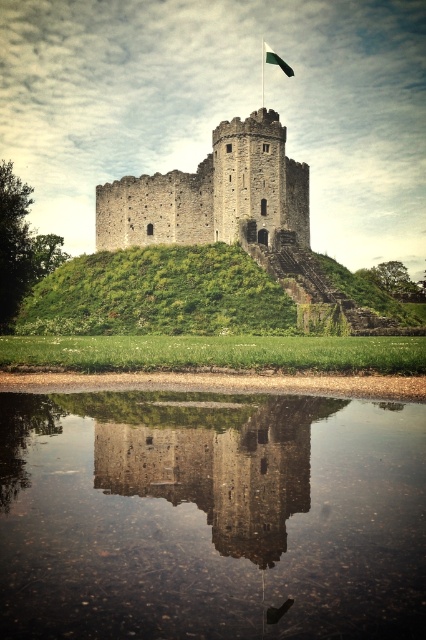
Is stone medieval tower at center above green fabric flag at upper center?

No.

Between point (192, 236) and point (264, 42), which one is positioned in front?

Point (192, 236)

You are a GUI agent. You are given a task and a screenshot of the screen. Output one action in this format:
    pyautogui.click(x=<x>, y=<y>)
    Task: Click on the stone medieval tower at center
    
    Given the screenshot: What is the action you would take?
    pyautogui.click(x=213, y=193)

Who is shorter, transparent glass water at center or stone medieval tower at center?

With less height is transparent glass water at center.

Is transparent glass water at center bigger than stone medieval tower at center?

No, transparent glass water at center is not bigger than stone medieval tower at center.

Does point (86, 525) come in front of point (253, 145)?

Yes, point (86, 525) is in front of point (253, 145).

At what (x,y) coordinates should I click in order to perform the action: click on transparent glass water at center. Please return your answer as a coordinate pair (x, y). This screenshot has height=640, width=426. Looking at the image, I should click on (210, 516).

Is transparent glass water at center positioned behind green fabric flag at upper center?

No.

Is transparent glass water at center taller than green fabric flag at upper center?

No.

Between point (154, 474) and point (264, 45), which one is positioned behind?

Positioned behind is point (264, 45).

Where is `transparent glass water at center`? The image size is (426, 640). transparent glass water at center is located at coordinates (210, 516).